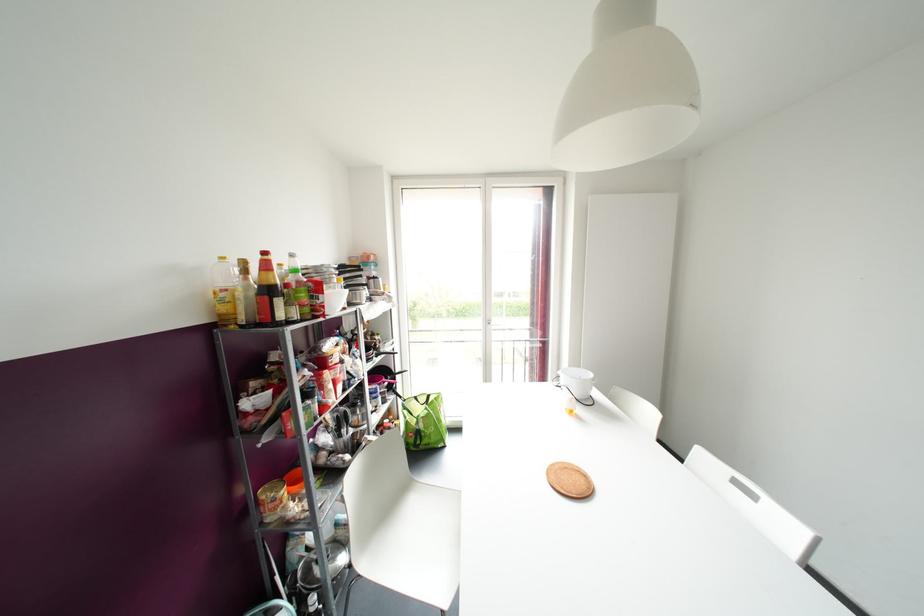
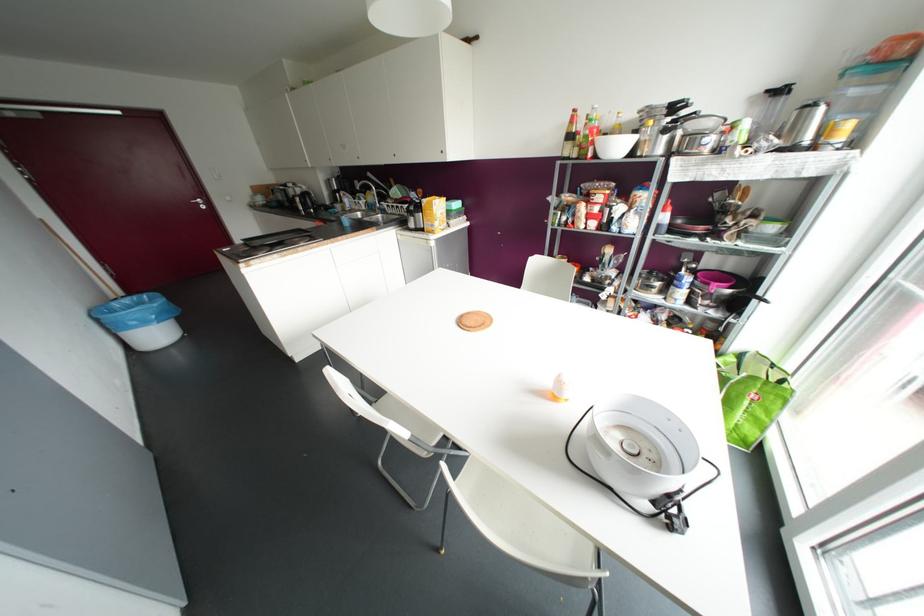
The point at (415, 397) is marked in the first image. Where is the corresponding point in the second image?

(772, 365)